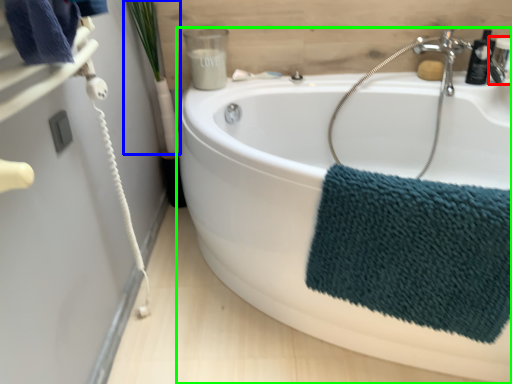
Question: Which object is positioned closest to plumbing fixture (highlighted by a red box)? Select from plant (highlighted by a blue box) and bathtub (highlighted by a green box).

Choices:
 (A) plant
 (B) bathtub

Answer: (B)